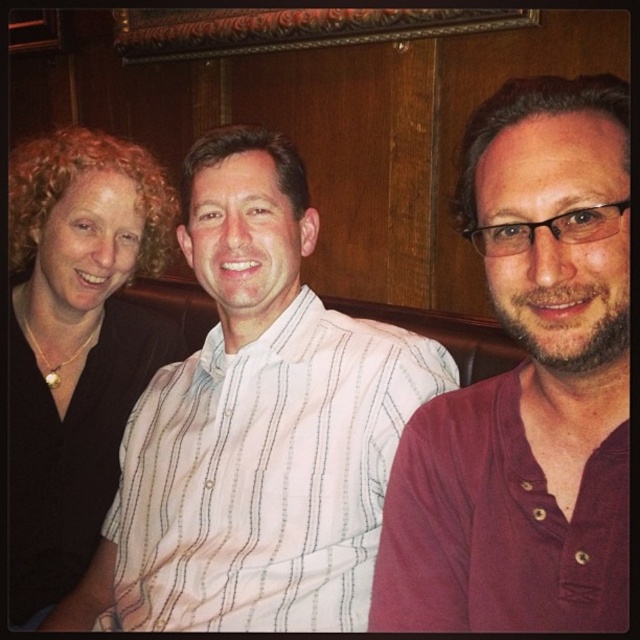
Can you confirm if maroon cotton shirt at right is thinner than black matte shirt at left?

Yes, maroon cotton shirt at right is thinner than black matte shirt at left.

Who is positioned more to the left, maroon cotton shirt at right or black matte shirt at left?

black matte shirt at left is more to the left.

Describe the element at coordinates (528, 387) in the screenshot. I see `maroon cotton shirt at right` at that location.

I want to click on maroon cotton shirt at right, so click(528, 387).

Looking at this image, is the position of white striped shirt at center more distant than that of black matte shirt at left?

Result: No, white striped shirt at center is in front of black matte shirt at left.

Is white striped shirt at center to the right of black matte shirt at left from the viewer's perspective?

Yes, white striped shirt at center is to the right of black matte shirt at left.

Measure the distance between white striped shirt at center and camera.

The distance of white striped shirt at center from camera is 35.56 inches.

The height and width of the screenshot is (640, 640). I want to click on white striped shirt at center, so click(x=266, y=476).

Does maroon cotton shirt at right appear under white striped shirt at center?

No.

Between maroon cotton shirt at right and white striped shirt at center, which one is positioned higher?

maroon cotton shirt at right is higher up.

Does point (513, 564) come behind point (284, 604)?

That is False.

The image size is (640, 640). Identify the location of maroon cotton shirt at right. (528, 387).